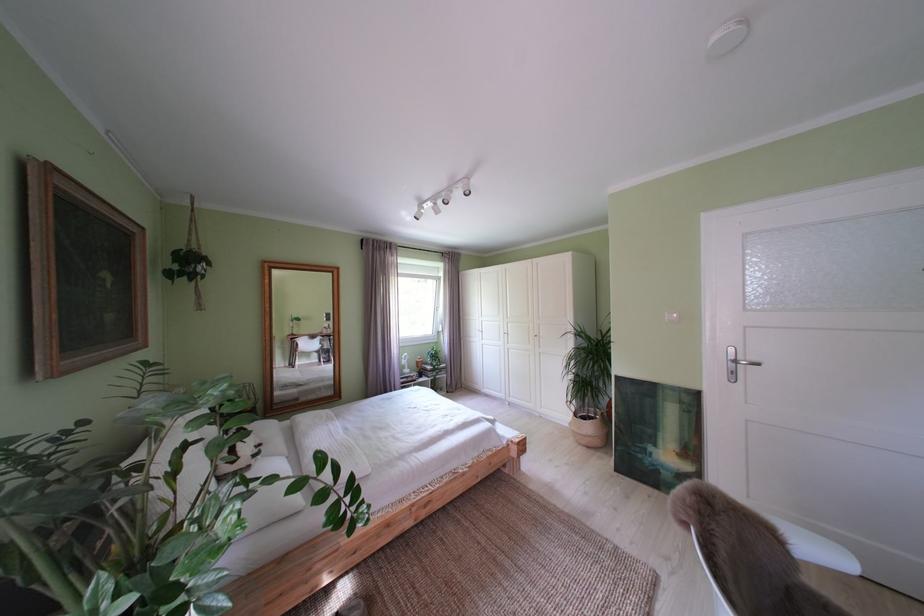
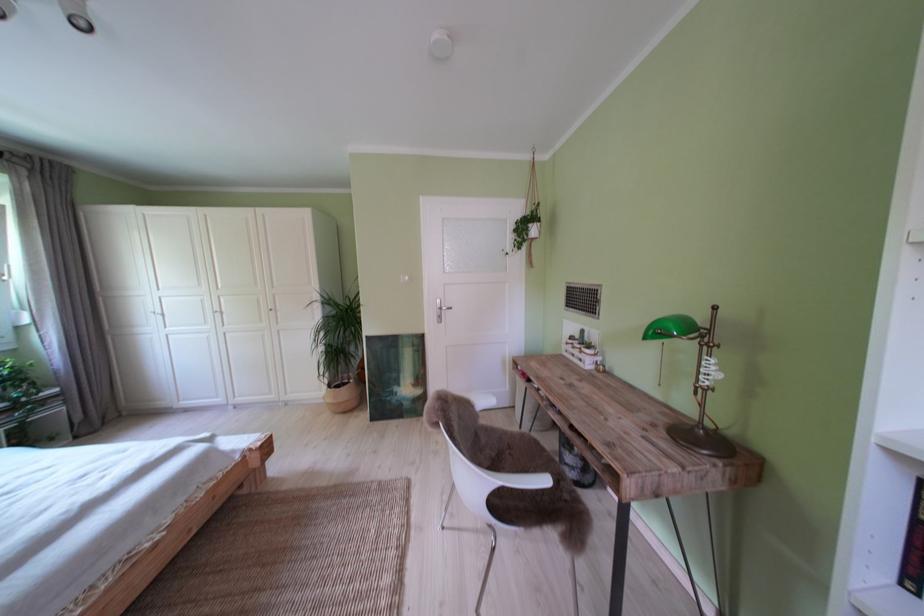
The point at (743, 355) is marked in the first image. Where is the corresponding point in the second image?

(450, 307)